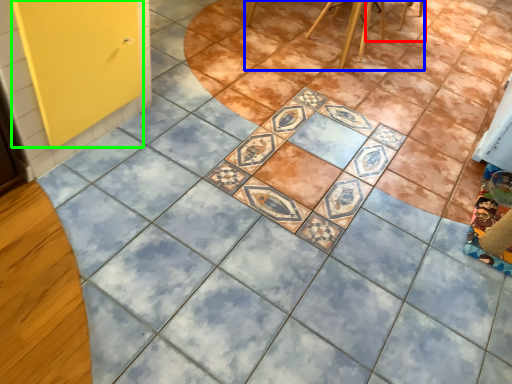
Question: Based on their relative distances, which object is farther from chair (highlighted by a red box)? Choose from furniture (highlighted by a blue box) and screen door (highlighted by a green box).

Choices:
 (A) furniture
 (B) screen door

Answer: (B)